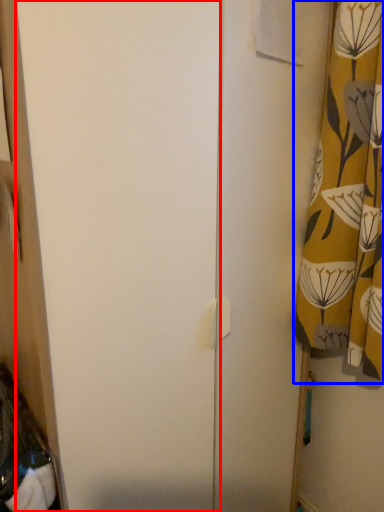
Question: Which of the following is the closest to the observer, screen door (highlighted by a red box) or curtain (highlighted by a blue box)?

Choices:
 (A) screen door
 (B) curtain

Answer: (A)